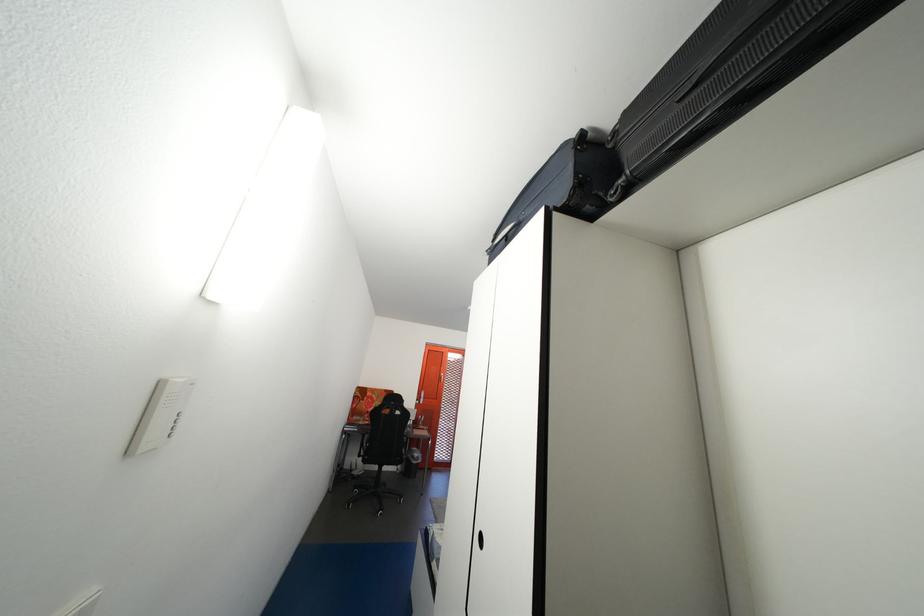
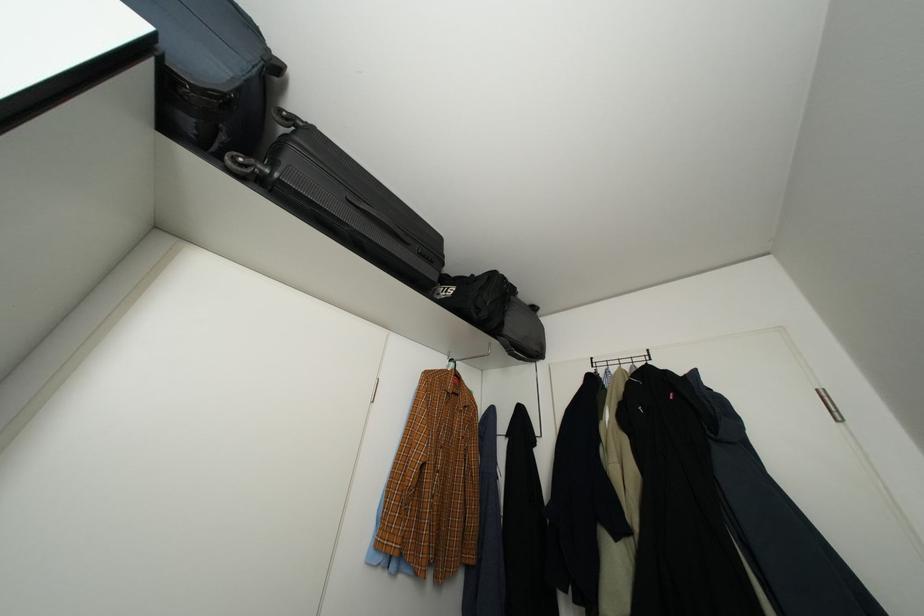
Where in the second image is the point corresponding to (636,120) from the first image?

(323, 135)